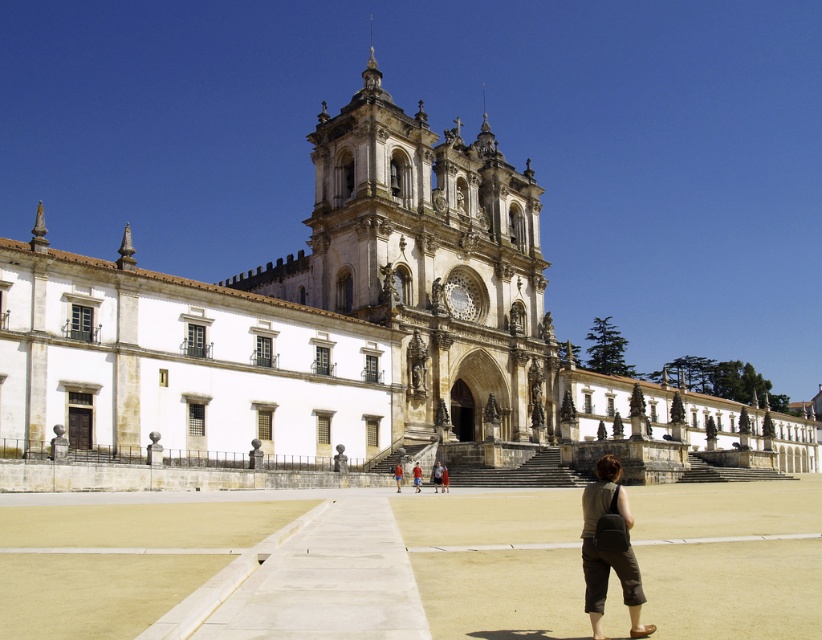
You are standing in front of the grand historic building and want to take a photo of both the white stone church at center and the white stone tower at center. Which object should you position to your left to include both in the frame?

The white stone church at center is positioned on the left side of the white stone tower at center, so you should position the white stone church at center to your left to include both in the frame.

You are a visitor standing in front of the grand historic building. You notice a person wearing brown fabric pants at lower right and a red shirt at center. From your vantage point, which clothing item appears closer to you?

The brown fabric pants at lower right appears closer because it is in front of the red shirt at center.